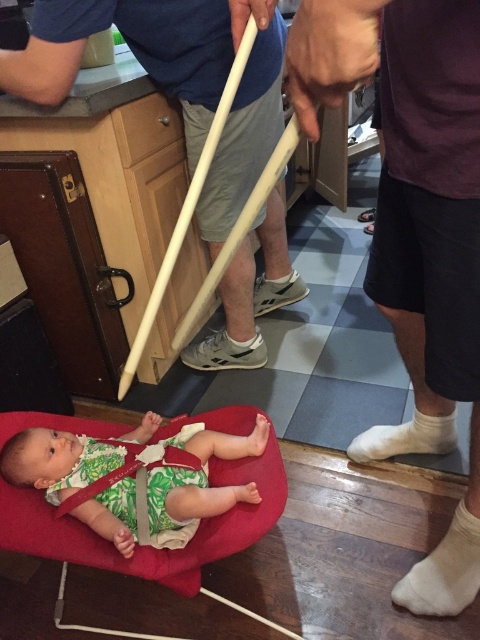
You are a parent trying to decide where to place a new toy. You see the green leafy fabric baby at lower left and the white cotton sock at lower right. Which object is closer to the left side of the image?

The green leafy fabric baby at lower left is closer to the left side of the image as it is positioned to the left of the white cotton sock at lower right.

You are a parent trying to place a new toy on the floor near the baby. The baby is sitting in the red bouncy chair at the center. You want to put the toy at point (x=201, y=477). Is this point near the baby?

The point (x=201, y=477) is at the lower left of the green leafy fabric baby, so yes, placing the toy there would be near the baby.